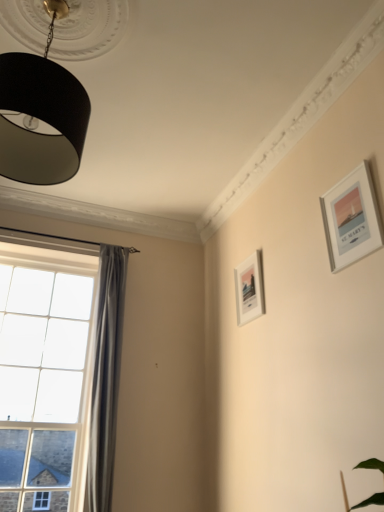
Question: Is black matte lampshade at upper left shorter than clear glass window at left?

Choices:
 (A) yes
 (B) no

Answer: (A)

Question: Is black matte lampshade at upper left at the left side of clear glass window at left?

Choices:
 (A) yes
 (B) no

Answer: (B)

Question: Is black matte lampshade at upper left wider than clear glass window at left?

Choices:
 (A) yes
 (B) no

Answer: (A)

Question: From a real-world perspective, is black matte lampshade at upper left located beneath clear glass window at left?

Choices:
 (A) no
 (B) yes

Answer: (A)

Question: Is black matte lampshade at upper left positioned far away from clear glass window at left?

Choices:
 (A) yes
 (B) no

Answer: (A)

Question: Does black matte lampshade at upper left have a lesser width compared to clear glass window at left?

Choices:
 (A) no
 (B) yes

Answer: (A)

Question: Does white matte picture frame at center-right, which is counted as the second picture frame, starting from the top, appear on the left side of silver metallic picture frame at upper right, the first picture frame in the right-to-left sequence?

Choices:
 (A) no
 (B) yes

Answer: (B)

Question: Is white matte picture frame at center-right, which is the 2th picture frame from front to back, positioned before silver metallic picture frame at upper right, the second picture frame in the back-to-front sequence?

Choices:
 (A) yes
 (B) no

Answer: (B)

Question: Is white matte picture frame at center-right, marked as the 2th picture frame in a right-to-left arrangement, far away from silver metallic picture frame at upper right, placed as the 2th picture frame when sorted from left to right?

Choices:
 (A) yes
 (B) no

Answer: (B)

Question: Considering the relative sizes of white matte picture frame at center-right, which is counted as the second picture frame, starting from the top, and silver metallic picture frame at upper right, the first picture frame in the right-to-left sequence, in the image provided, is white matte picture frame at center-right, which is counted as the second picture frame, starting from the top, smaller than silver metallic picture frame at upper right, the first picture frame in the right-to-left sequence,?

Choices:
 (A) yes
 (B) no

Answer: (A)

Question: Considering the relative sizes of white matte picture frame at center-right, marked as the 2th picture frame in a right-to-left arrangement, and silver metallic picture frame at upper right, which is counted as the 1th picture frame, starting from the front, in the image provided, is white matte picture frame at center-right, marked as the 2th picture frame in a right-to-left arrangement, wider than silver metallic picture frame at upper right, which is counted as the 1th picture frame, starting from the front,?

Choices:
 (A) no
 (B) yes

Answer: (A)

Question: Is white matte picture frame at center-right, which is counted as the second picture frame, starting from the top, not within silver metallic picture frame at upper right, the 1th picture frame from the top?

Choices:
 (A) yes
 (B) no

Answer: (A)

Question: Can we say satin grey curtain at left lies outside clear glass window at left?

Choices:
 (A) yes
 (B) no

Answer: (A)